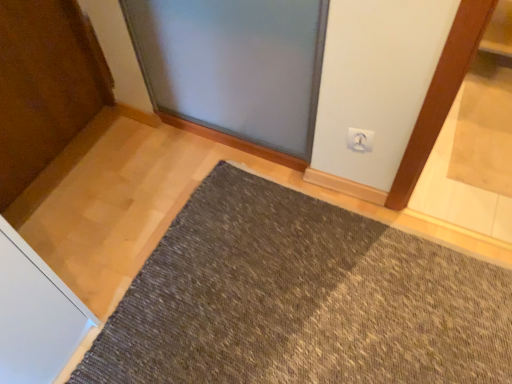
What do you see at coordinates (301, 300) in the screenshot? I see `dark gray textured mat at center` at bounding box center [301, 300].

Find the location of a particular element. This screenshot has width=512, height=384. dark gray textured mat at center is located at coordinates click(301, 300).

The width and height of the screenshot is (512, 384). Describe the element at coordinates (360, 140) in the screenshot. I see `white plastic electric outlet at upper right` at that location.

Locate an element on the screen. This screenshot has height=384, width=512. white plastic electric outlet at upper right is located at coordinates (360, 140).

Identify the location of dark gray textured mat at center. This screenshot has height=384, width=512. (301, 300).

Is dark gray textured mat at center at the right side of white plastic electric outlet at upper right?

Incorrect, dark gray textured mat at center is not on the right side of white plastic electric outlet at upper right.

Considering the relative positions of dark gray textured mat at center and white plastic electric outlet at upper right in the image provided, is dark gray textured mat at center behind white plastic electric outlet at upper right?

No.

Which is behind, point (429, 322) or point (361, 135)?

The point (361, 135) is farther.

From the image's perspective, is dark gray textured mat at center above or below white plastic electric outlet at upper right?

From the image's perspective, dark gray textured mat at center appears below white plastic electric outlet at upper right.

From a real-world perspective, is dark gray textured mat at center positioned above or below white plastic electric outlet at upper right?

Clearly, from a real-world perspective, dark gray textured mat at center is below white plastic electric outlet at upper right.

Does dark gray textured mat at center have a greater width compared to white plastic electric outlet at upper right?

Yes.

Does dark gray textured mat at center have a lesser height compared to white plastic electric outlet at upper right?

Yes.

Is dark gray textured mat at center smaller than white plastic electric outlet at upper right?

No.

Would you say dark gray textured mat at center contains white plastic electric outlet at upper right?

No, dark gray textured mat at center does not contain white plastic electric outlet at upper right.

Is dark gray textured mat at center not near white plastic electric outlet at upper right?

Actually, dark gray textured mat at center and white plastic electric outlet at upper right are a little close together.

Does dark gray textured mat at center turn towards white plastic electric outlet at upper right?

No.

What's the angular difference between dark gray textured mat at center and white plastic electric outlet at upper right's facing directions?

88.9 degrees.

Where is `mat in front of the white plastic electric outlet at upper right`? This screenshot has height=384, width=512. mat in front of the white plastic electric outlet at upper right is located at coordinates (301, 300).

Looking at this image, is white plastic electric outlet at upper right to the right of dark gray textured mat at center from the viewer's perspective?

Yes.

Which is in front, white plastic electric outlet at upper right or dark gray textured mat at center?

dark gray textured mat at center is closer to the camera.

Between point (365, 151) and point (249, 273), which one is positioned behind?

Point (365, 151)

From the image's perspective, would you say white plastic electric outlet at upper right is positioned over dark gray textured mat at center?

Yes.

In the scene shown: From a real-world perspective, is white plastic electric outlet at upper right physically above dark gray textured mat at center?

Yes, from a real-world perspective, white plastic electric outlet at upper right is over dark gray textured mat at center

Considering the relative sizes of white plastic electric outlet at upper right and dark gray textured mat at center in the image provided, is white plastic electric outlet at upper right wider than dark gray textured mat at center?

Answer: In fact, white plastic electric outlet at upper right might be narrower than dark gray textured mat at center.

Which of these two, white plastic electric outlet at upper right or dark gray textured mat at center, stands taller?

white plastic electric outlet at upper right is taller.

Does white plastic electric outlet at upper right have a larger size compared to dark gray textured mat at center?

Actually, white plastic electric outlet at upper right might be smaller than dark gray textured mat at center.

In the scene shown: Is white plastic electric outlet at upper right not within dark gray textured mat at center?

Indeed, white plastic electric outlet at upper right is completely outside dark gray textured mat at center.

Is white plastic electric outlet at upper right positioned far away from dark gray textured mat at center?

No.

Is white plastic electric outlet at upper right positioned with its back to dark gray textured mat at center?

white plastic electric outlet at upper right does not have its back to dark gray textured mat at center.

I want to click on electric outlet above the dark gray textured mat at center (from a real-world perspective), so click(x=360, y=140).

Where is `mat in front of the white plastic electric outlet at upper right`? mat in front of the white plastic electric outlet at upper right is located at coordinates (301, 300).

Find the location of a particular element. electric outlet to the right of dark gray textured mat at center is located at coordinates (360, 140).